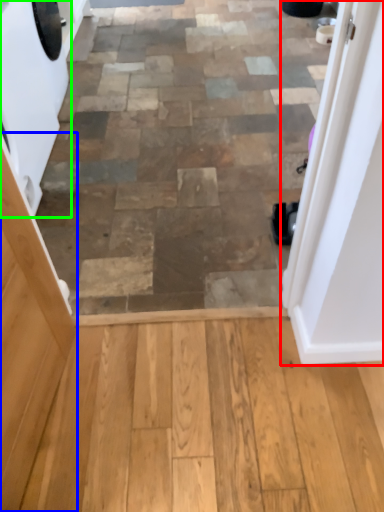
Question: Estimate the real-world distances between objects in this image. Which object is farther from door (highlighted by a red box), screen door (highlighted by a blue box) or washing machine (highlighted by a green box)?

Choices:
 (A) screen door
 (B) washing machine

Answer: (B)